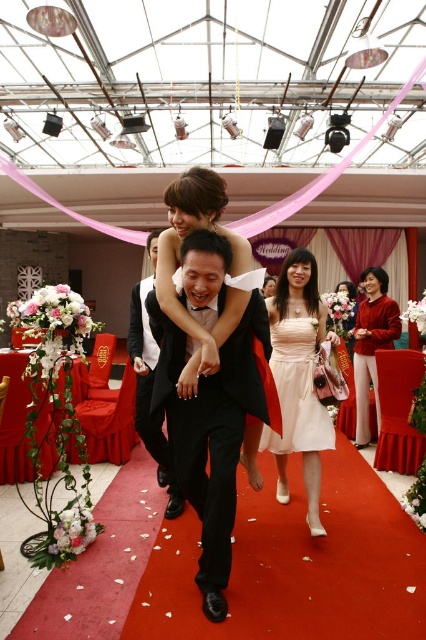
Question: Is pale pink satin dress at center smaller than matte red sweater at center?

Choices:
 (A) no
 (B) yes

Answer: (B)

Question: Which point is farther to the camera?

Choices:
 (A) (264, 416)
 (B) (354, 376)
 (C) (284, 339)

Answer: (B)

Question: Is black satin tuxedo at center behind matte red sweater at center?

Choices:
 (A) yes
 (B) no

Answer: (B)

Question: Which object is the closest to the matte red sweater at center?

Choices:
 (A) pale pink satin dress at center
 (B) black satin tuxedo at center

Answer: (A)

Question: Does black satin tuxedo at center have a larger size compared to pale pink satin dress at center?

Choices:
 (A) no
 (B) yes

Answer: (B)

Question: Which point is farther from the camera taking this photo?

Choices:
 (A) (388, 346)
 (B) (287, 404)

Answer: (A)